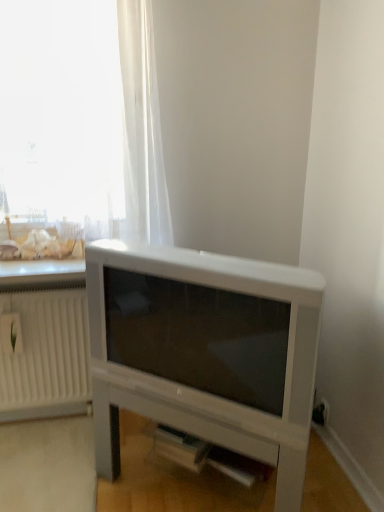
This screenshot has width=384, height=512. I want to click on spots to the right of white plastic radiator at left, so click(88, 430).